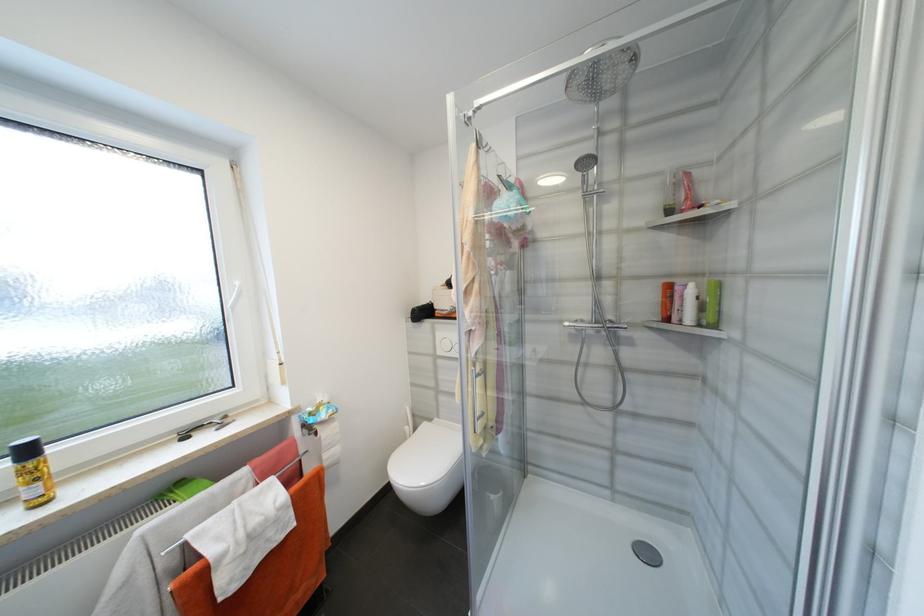
Identify the location of white window handle. The height and width of the screenshot is (616, 924). (236, 294).